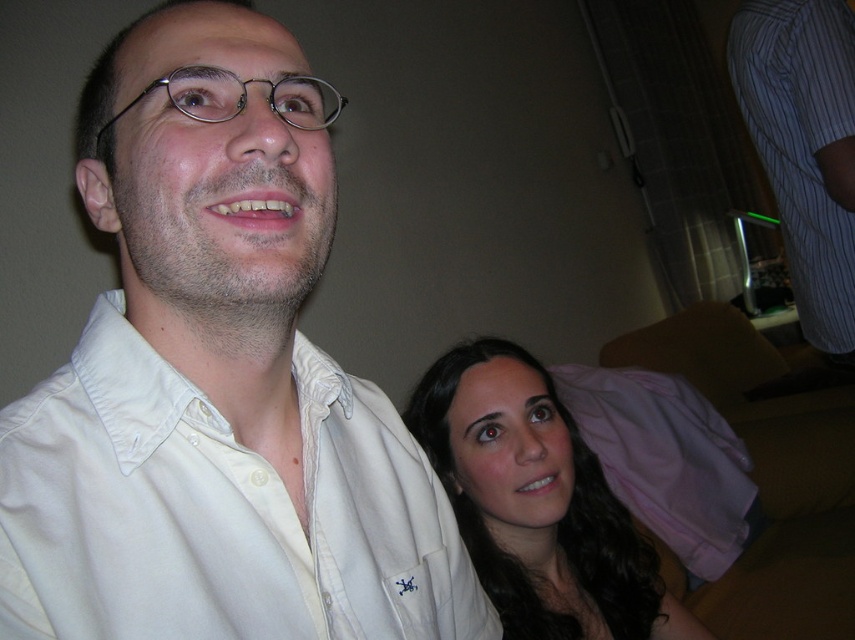
Question: Which point is farther to the camera?

Choices:
 (A) (289, 420)
 (B) (805, 24)
 (C) (558, 541)

Answer: (B)

Question: Based on their relative distances, which object is nearer to the white cotton shirt at center?

Choices:
 (A) striped cotton dress shirt at upper right
 (B) dark brown hair at lower right

Answer: (B)

Question: Which point is closer to the camera?

Choices:
 (A) (517, 563)
 (B) (838, 269)

Answer: (A)

Question: Can you confirm if dark brown hair at lower right is thinner than striped cotton dress shirt at upper right?

Choices:
 (A) no
 (B) yes

Answer: (A)

Question: Can you confirm if white cotton shirt at center is thinner than striped cotton dress shirt at upper right?

Choices:
 (A) yes
 (B) no

Answer: (B)

Question: Does white cotton shirt at center appear on the left side of striped cotton dress shirt at upper right?

Choices:
 (A) yes
 (B) no

Answer: (A)